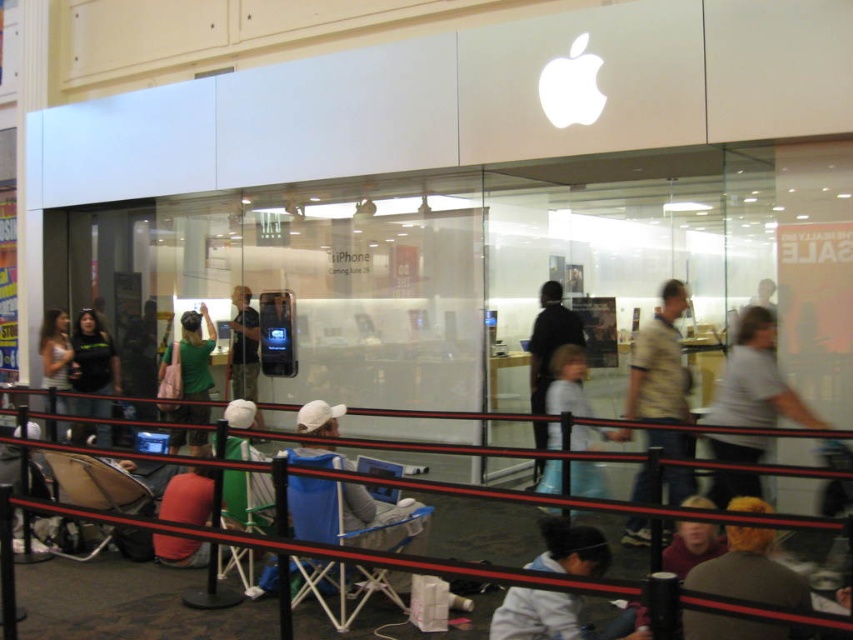
You are standing in front of the Apple store and want to reach the entrance. There are two points marked on the ground, point (94, 330) and point (44, 371). Which point is closer to you as you face the store?

Point (94, 330) is closer to the viewer than point (44, 371).